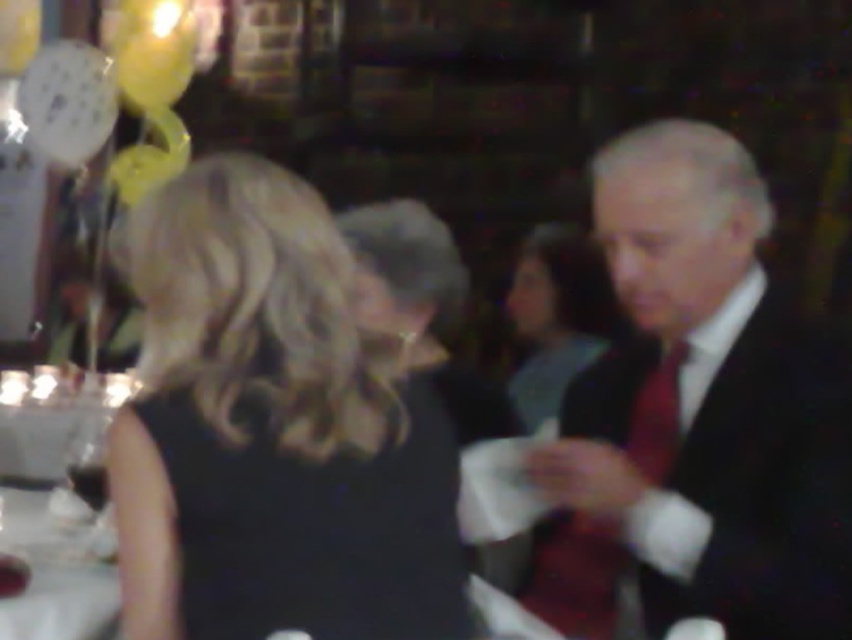
You are at a party and want to find the shortest person between the black silk dress at center and the matte black suit at right. Which one should you look for?

The black silk dress at center has a lesser height compared to matte black suit at right, so the shortest person is the one wearing the black silk dress at center.

You are a photographer at the event and need to adjust the camera focus. The matte black suit at right and the smooth black dress at center are both in the frame. Given their distance apart, can you focus on both subjects simultaneously if your camera has a depth of field that can cover 1.1 meters?

The matte black suit at right is 1.06 meters away from the smooth black dress at center. Since the distance between them is less than the camera depth of field of 1.1 meters, the photographer can focus on both subjects simultaneously.

You are organizing a charity event and need to arrange seating based on the guests attire. The black silk dress at center and the matte black suit at right are both present. Which guest should be seated first according to the size of their attire?

The black silk dress at center should be seated first because it is bigger than the matte black suit at right, so seating priority is given to the larger attire.